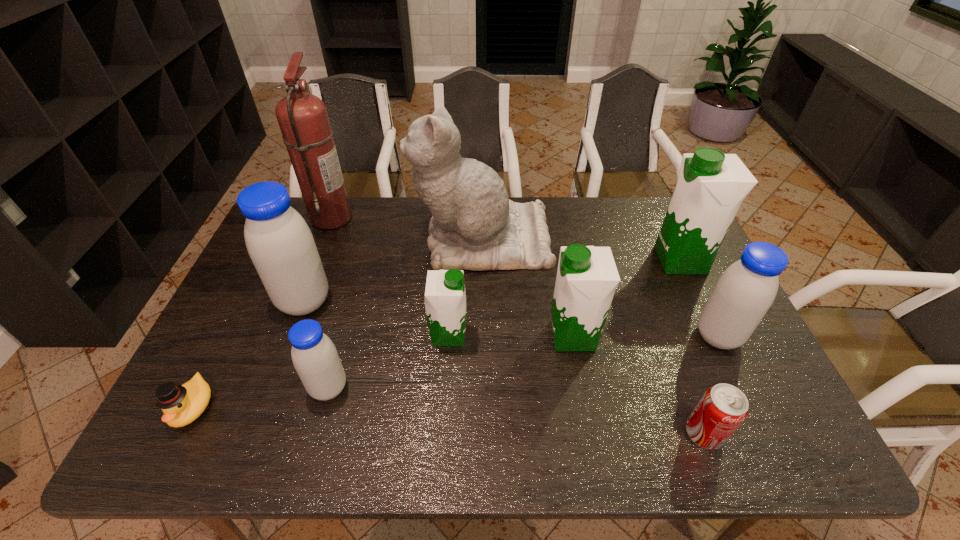
At what (x,y) coordinates should I click in order to perform the action: click on the leftmost green soya milk. Please return your answer as a coordinate pair (x, y). The width and height of the screenshot is (960, 540). Looking at the image, I should click on (445, 298).

Find the location of a particular element. the second blue soya milk from left to right is located at coordinates (314, 356).

The width and height of the screenshot is (960, 540). I want to click on the fourth object from left to right, so click(x=314, y=356).

This screenshot has width=960, height=540. I want to click on the eighth object from left to right, so click(x=723, y=407).

Find the location of a particular element. Image resolution: width=960 pixels, height=540 pixels. the ninth tallest object is located at coordinates (723, 407).

Find the location of a particular element. This screenshot has width=960, height=540. duck is located at coordinates (181, 405).

Identify the location of the shortest object. (181, 405).

Locate an element on the screen. The height and width of the screenshot is (540, 960). vacant space located on the front-facing side of the fire extinguisher is located at coordinates click(393, 217).

Locate an element on the screen. free location located 0.400m on the front-facing side of the cat is located at coordinates (292, 239).

Find the location of `vacant space located on the front-facing side of the cat`. vacant space located on the front-facing side of the cat is located at coordinates (301, 239).